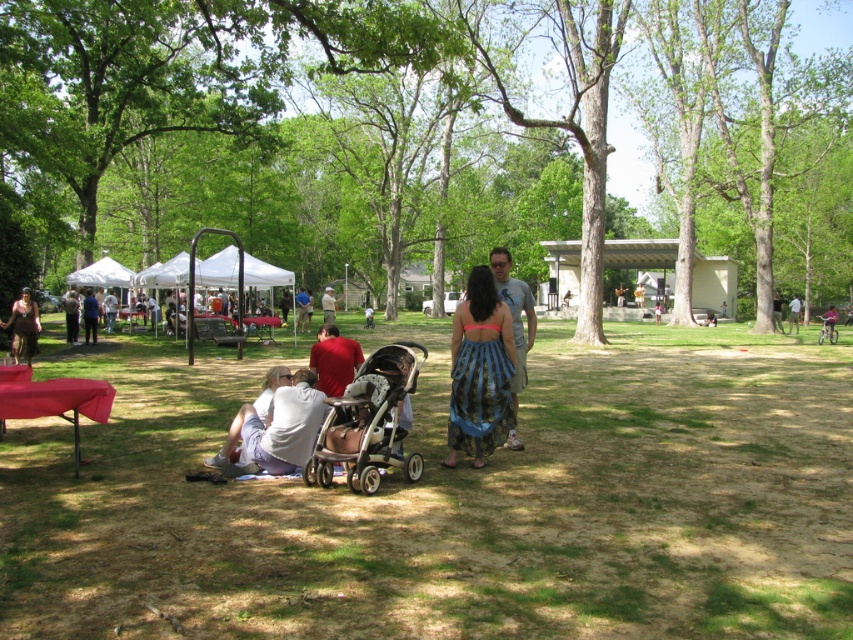
Question: Does gray cotton t-shirt at center have a smaller size compared to matte pink dress at center?

Choices:
 (A) yes
 (B) no

Answer: (B)

Question: Does blue printed dress at center lie in front of matte pink dress at center?

Choices:
 (A) no
 (B) yes

Answer: (B)

Question: Based on their relative distances, which object is farther from the blue printed dress at center?

Choices:
 (A) white fabric canopy at left
 (B) beige fabric stroller at center

Answer: (A)

Question: Considering the relative positions of matte pink dress at center and matte gray shirt at center in the image provided, where is matte pink dress at center located with respect to matte gray shirt at center?

Choices:
 (A) right
 (B) left

Answer: (B)

Question: Which object appears farthest from the camera in this image?

Choices:
 (A) light brown wooden chair at center
 (B) blue printed dress at center

Answer: (A)

Question: Among these points, which one is farthest from the camera?

Choices:
 (A) (107, 284)
 (B) (518, 387)

Answer: (A)